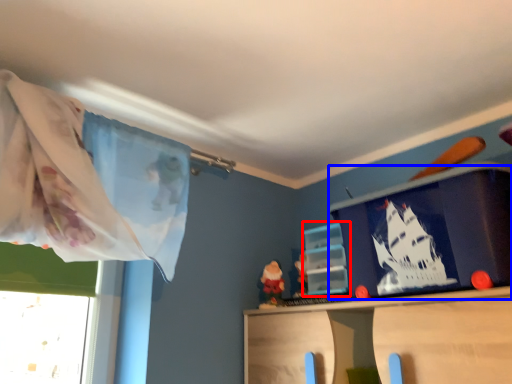
Question: Which object appears farthest to the camera in this image, shelf (highlighted by a red box) or window screen (highlighted by a blue box)?

Choices:
 (A) shelf
 (B) window screen

Answer: (A)